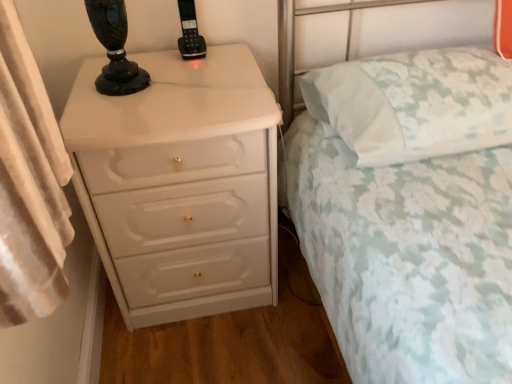
Identify the location of free space that is in between white floral fabric bed at center and white glossy chest of drawers at left. (233, 347).